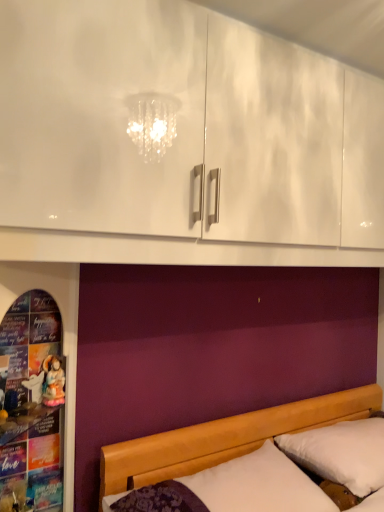
Question: In terms of width, does matte porcelain doll at left look wider or thinner when compared to white soft pillow at lower right?

Choices:
 (A) thin
 (B) wide

Answer: (A)

Question: In the image, is matte porcelain doll at left on the left side or the right side of white soft pillow at lower right?

Choices:
 (A) left
 (B) right

Answer: (A)

Question: Which object is positioned farthest from the matte porcelain doll at left?

Choices:
 (A) wooden bed at lower right
 (B) white soft pillow at lower right

Answer: (B)

Question: Which object is the closest to the matte porcelain doll at left?

Choices:
 (A) wooden bed at lower right
 (B) white soft pillow at lower right

Answer: (A)